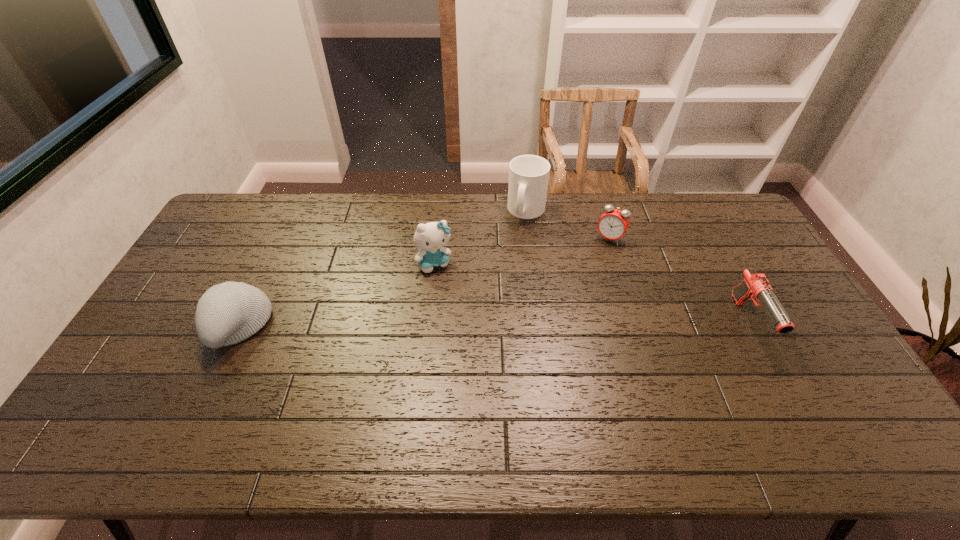
The image size is (960, 540). I want to click on free spot on the desktop that is between the leftmost object and the gun and is positioned on the face of the kitten, so click(x=468, y=325).

I want to click on free spot on the desktop that is between the leftmost object and the gun and is positioned on the handle side of the farthest object, so click(x=513, y=324).

I want to click on free spot on the desktop that is between the beanie and the rightmost object and is positioned on the front-facing side of the second object from right to left, so click(x=560, y=323).